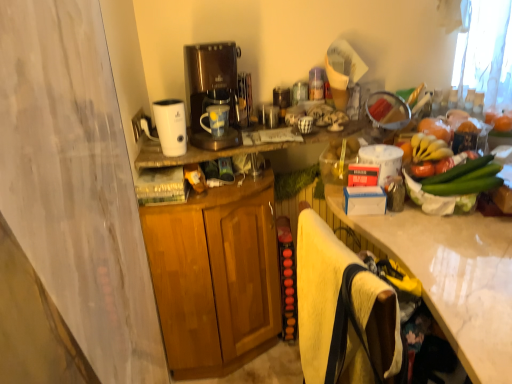
Question: Considering the relative positions of white glossy humidifier at upper center and matte white mug at center in the image provided, is white glossy humidifier at upper center to the right of matte white mug at center from the viewer's perspective?

Choices:
 (A) yes
 (B) no

Answer: (B)

Question: From the image's perspective, is white glossy humidifier at upper center above matte white mug at center?

Choices:
 (A) no
 (B) yes

Answer: (A)

Question: Is white glossy humidifier at upper center with matte white mug at center?

Choices:
 (A) no
 (B) yes

Answer: (A)

Question: Is the depth of white glossy humidifier at upper center greater than that of matte white mug at center?

Choices:
 (A) no
 (B) yes

Answer: (A)

Question: Can we say white glossy humidifier at upper center lies outside matte white mug at center?

Choices:
 (A) yes
 (B) no

Answer: (A)

Question: Is white glossy humidifier at upper center positioned before matte white mug at center?

Choices:
 (A) yes
 (B) no

Answer: (A)

Question: Considering the relative sizes of white marble countertop at right and matte white mug at center in the image provided, is white marble countertop at right wider than matte white mug at center?

Choices:
 (A) yes
 (B) no

Answer: (A)

Question: Is white marble countertop at right surrounding matte white mug at center?

Choices:
 (A) yes
 (B) no

Answer: (B)

Question: Does white marble countertop at right appear on the left side of matte white mug at center?

Choices:
 (A) no
 (B) yes

Answer: (A)

Question: Is white marble countertop at right completely or partially outside of matte white mug at center?

Choices:
 (A) yes
 (B) no

Answer: (A)

Question: Considering the relative positions of white marble countertop at right and matte white mug at center in the image provided, is white marble countertop at right behind matte white mug at center?

Choices:
 (A) yes
 (B) no

Answer: (B)

Question: Could you tell me if white marble countertop at right is turned towards matte white mug at center?

Choices:
 (A) yes
 (B) no

Answer: (B)

Question: Is white marble countertop at right at the back of wooden cabinet at center?

Choices:
 (A) no
 (B) yes

Answer: (A)